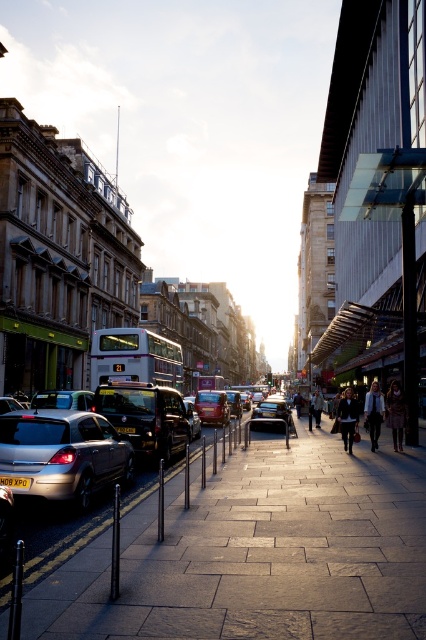
Question: Among these points, which one is nearest to the camera?

Choices:
 (A) (34, 410)
 (B) (212, 401)

Answer: (A)

Question: Which point is closer to the camera?

Choices:
 (A) paved stone sidewalk at center
 (B) metallic silver car at center

Answer: (A)

Question: Which point is closer to the camera?

Choices:
 (A) paved stone sidewalk at center
 (B) dark gray casual wear at center

Answer: (A)

Question: Does white textured coat at center appear on the left side of dark gray sweater at center?

Choices:
 (A) yes
 (B) no

Answer: (B)

Question: Can you confirm if white textured coat at center is positioned to the left of dark gray sweater at center?

Choices:
 (A) no
 (B) yes

Answer: (A)

Question: Does black glossy car at center appear over white textured coat at center?

Choices:
 (A) yes
 (B) no

Answer: (A)